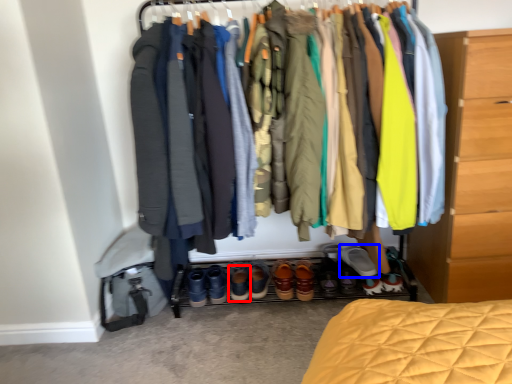
Question: Among these objects, which one is farthest to the camera, footwear (highlighted by a red box) or footwear (highlighted by a blue box)?

Choices:
 (A) footwear
 (B) footwear

Answer: (A)